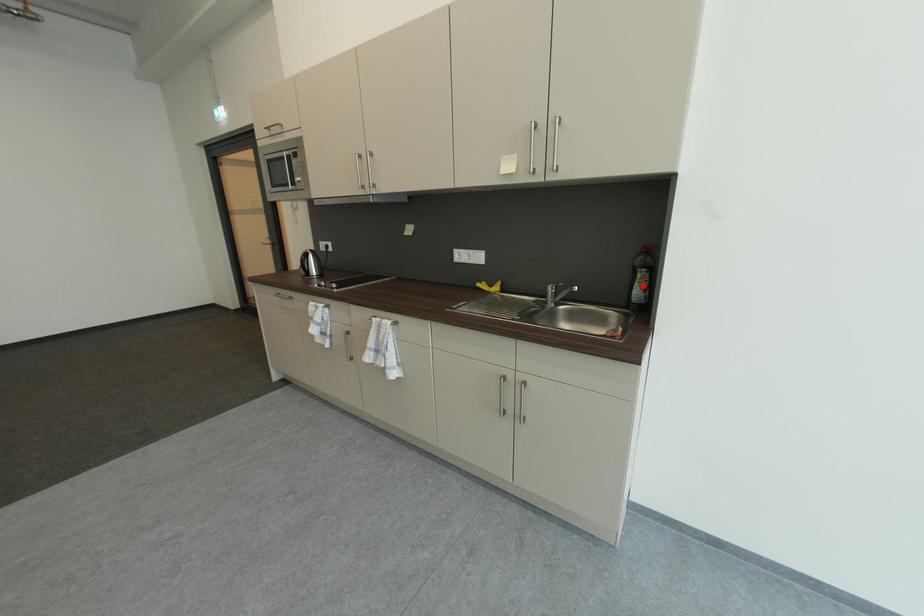
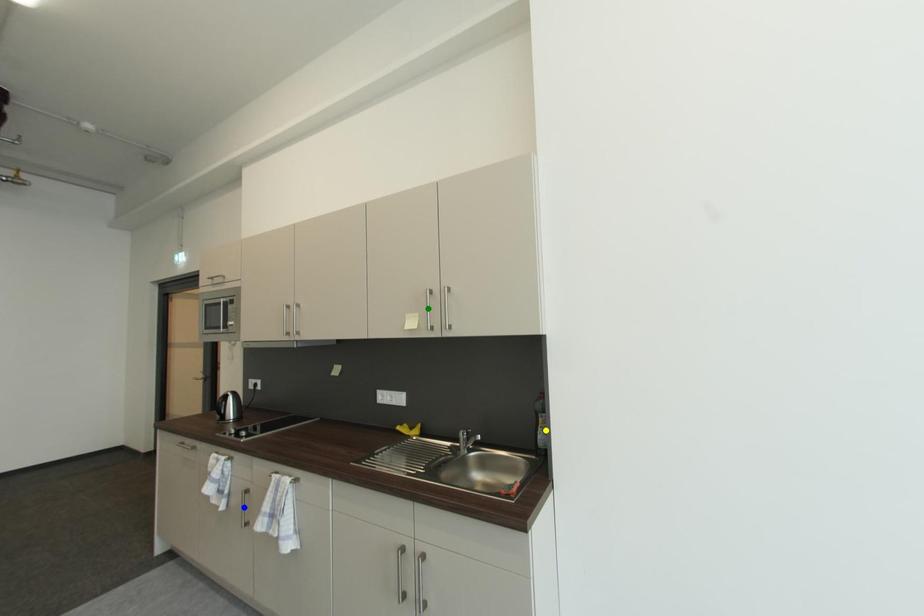
Question: I am providing you with two images of the same scene from different viewpoints. A red point is marked on the first image. You are given multiple points on the second image. Which point in image 2 is actually the same real-world point as the red point in image 1?

Choices:
 (A) blue point
 (B) green point
 (C) yellow point

Answer: (C)